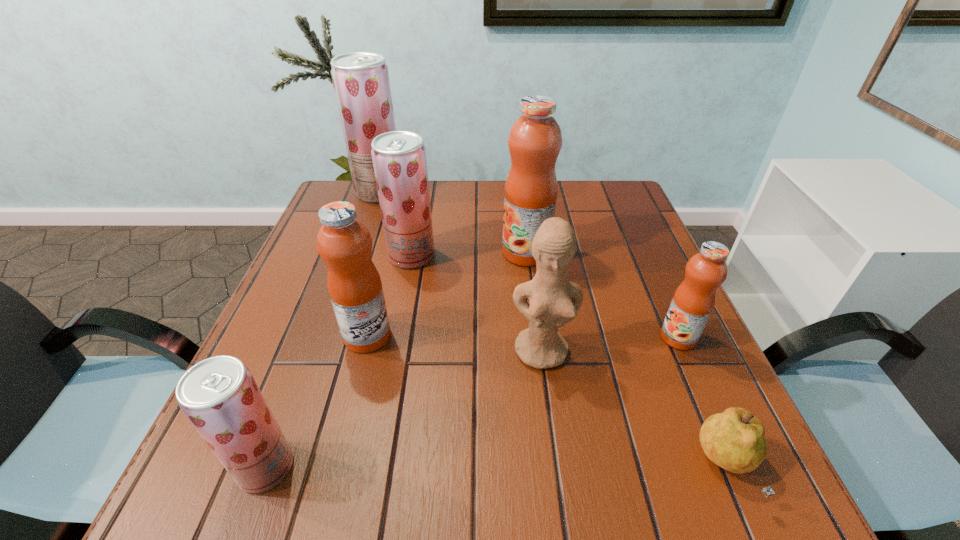
The image size is (960, 540). I want to click on the farthest fruit juice, so click(361, 83).

Image resolution: width=960 pixels, height=540 pixels. I want to click on the farthest object, so click(361, 83).

Image resolution: width=960 pixels, height=540 pixels. Find the location of `the biggest orange fruit juice`. the biggest orange fruit juice is located at coordinates (535, 139).

The image size is (960, 540). Find the location of `the farthest orange fruit juice`. the farthest orange fruit juice is located at coordinates (535, 139).

The width and height of the screenshot is (960, 540). I want to click on the rightmost strawberry fruit juice, so click(x=399, y=158).

Find the location of `the second farthest strawberry fruit juice`. the second farthest strawberry fruit juice is located at coordinates (399, 158).

Where is `the leftmost orange fruit juice`? This screenshot has width=960, height=540. the leftmost orange fruit juice is located at coordinates (344, 243).

Find the location of a particular element. The width and height of the screenshot is (960, 540). figurine is located at coordinates (554, 301).

Where is `the nearest fruit juice`? This screenshot has height=540, width=960. the nearest fruit juice is located at coordinates (219, 396).

At what (x,y) coordinates should I click in order to perform the action: click on the smallest strawberry fruit juice. Please return your answer as a coordinate pair (x, y). Looking at the image, I should click on (219, 396).